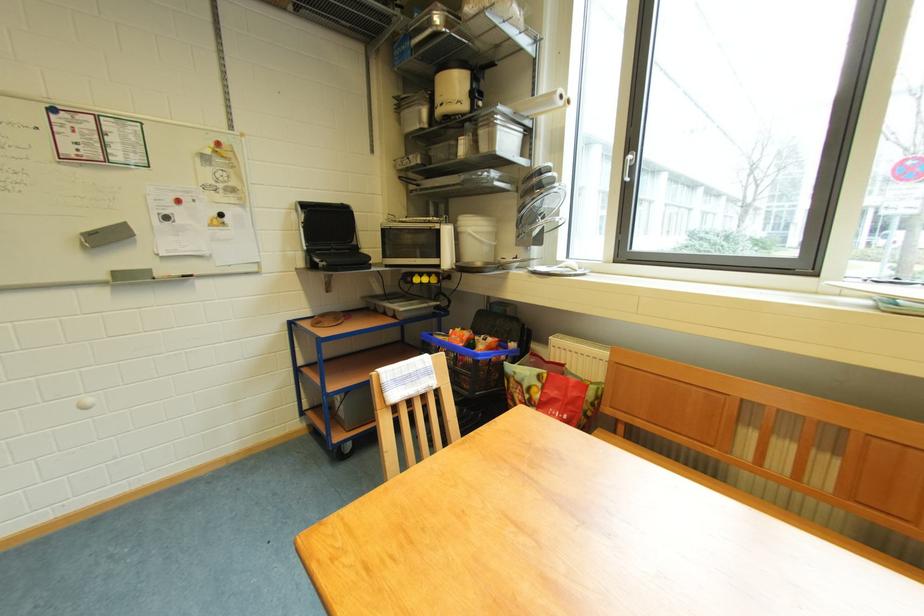
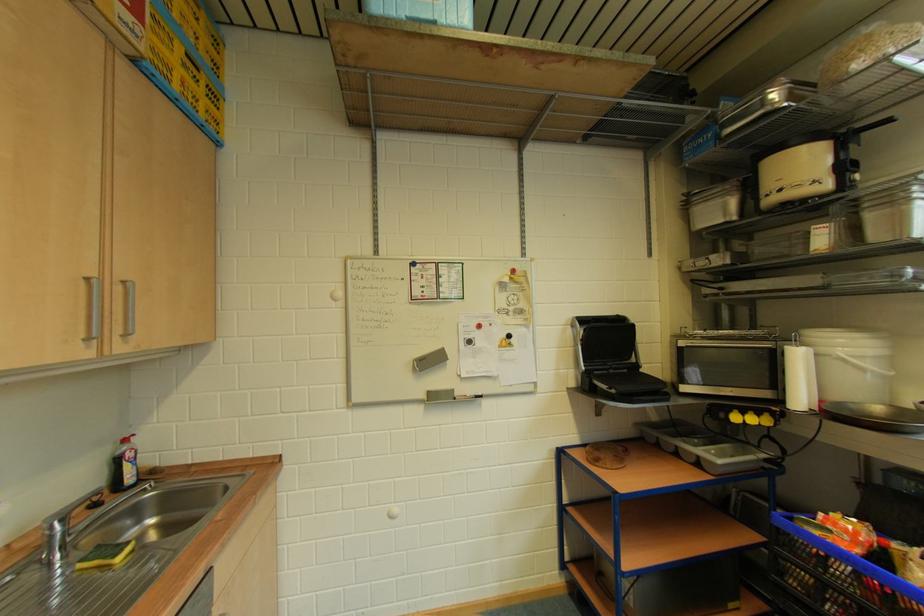
The point at (455, 235) is marked in the first image. Where is the corresponding point in the second image?

(805, 359)